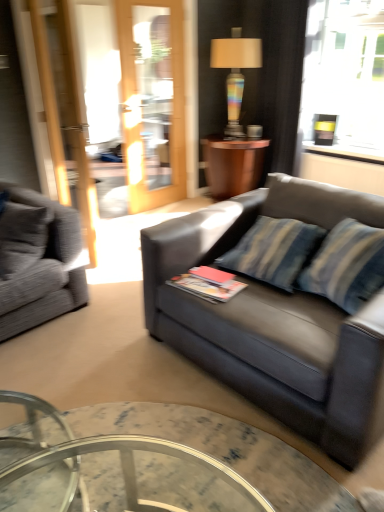
The image size is (384, 512). What do you see at coordinates (38, 261) in the screenshot?
I see `gray fabric couch at left, marked as the second studio couch in a right-to-left arrangement` at bounding box center [38, 261].

Image resolution: width=384 pixels, height=512 pixels. What do you see at coordinates (224, 450) in the screenshot?
I see `marble glass coffee table at center` at bounding box center [224, 450].

This screenshot has width=384, height=512. What do you see at coordinates (275, 320) in the screenshot? I see `slate gray leather couch at center, which is counted as the 2th studio couch, starting from the left` at bounding box center [275, 320].

Locate an element on the screen. gray fabric couch at left, the 1th studio couch viewed from the left is located at coordinates (38, 261).

Is matte paper book at center positioned with its back to slate gray leather couch at center, which is the 1th studio couch in right-to-left order?

Yes, matte paper book at center is facing away from slate gray leather couch at center, which is the 1th studio couch in right-to-left order.

Which object is closer to the camera taking this photo, matte paper book at center or slate gray leather couch at center, which is the 1th studio couch in right-to-left order?

Positioned in front is slate gray leather couch at center, which is the 1th studio couch in right-to-left order.

Who is bigger, matte paper book at center or slate gray leather couch at center, which is counted as the 2th studio couch, starting from the left?

slate gray leather couch at center, which is counted as the 2th studio couch, starting from the left.

Is matte paper book at center to the right of slate gray leather couch at center, which is the 1th studio couch in right-to-left order, from the viewer's perspective?

No, matte paper book at center is not to the right of slate gray leather couch at center, which is the 1th studio couch in right-to-left order.

From the picture: From a real-world perspective, between rainbow glass lamp at upper center and matte paper book at center, who is vertically lower?

From a 3D spatial view, matte paper book at center is below.

This screenshot has width=384, height=512. Identify the location of book below the rainbow glass lamp at upper center (from a real-world perspective). (208, 284).

Is rainbow glass lamp at upper center taller than matte paper book at center?

Correct, rainbow glass lamp at upper center is much taller as matte paper book at center.

Can you confirm if slate gray leather couch at center, which is the 1th studio couch in right-to-left order, is taller than gray fabric couch at left, marked as the second studio couch in a right-to-left arrangement?

Correct, slate gray leather couch at center, which is the 1th studio couch in right-to-left order, is much taller as gray fabric couch at left, marked as the second studio couch in a right-to-left arrangement.

Considering the relative positions of slate gray leather couch at center, which is counted as the 2th studio couch, starting from the left, and gray fabric couch at left, the 1th studio couch viewed from the left, in the image provided, is slate gray leather couch at center, which is counted as the 2th studio couch, starting from the left, in front of gray fabric couch at left, the 1th studio couch viewed from the left,?

Yes, slate gray leather couch at center, which is counted as the 2th studio couch, starting from the left, is closer to the viewer.

Looking at this image, from the image's perspective, does slate gray leather couch at center, which is counted as the 2th studio couch, starting from the left, appear higher than gray fabric couch at left, the 1th studio couch viewed from the left?

No, from the image's perspective, slate gray leather couch at center, which is counted as the 2th studio couch, starting from the left, is not over gray fabric couch at left, the 1th studio couch viewed from the left.

In terms of width, does slate gray leather couch at center, which is the 1th studio couch in right-to-left order, look wider or thinner when compared to gray fabric couch at left, the 1th studio couch viewed from the left?

Clearly, slate gray leather couch at center, which is the 1th studio couch in right-to-left order, has more width compared to gray fabric couch at left, the 1th studio couch viewed from the left.

Is wooden side table at center beside marble glass coffee table at center?

No, wooden side table at center is not touching marble glass coffee table at center.

Image resolution: width=384 pixels, height=512 pixels. Identify the location of table lying above the marble glass coffee table at center (from the image's perspective). (232, 164).

Is wooden side table at center outside of marble glass coffee table at center?

Yes, wooden side table at center is not within marble glass coffee table at center.

Between wooden side table at center and marble glass coffee table at center, which one is positioned behind?

wooden side table at center is behind.

Based on the photo, could you tell me if wooden side table at center is facing gray fabric couch at left, the 1th studio couch viewed from the left?

No.

Based on the photo, considering the relative sizes of wooden side table at center and gray fabric couch at left, the 1th studio couch viewed from the left, in the image provided, is wooden side table at center shorter than gray fabric couch at left, the 1th studio couch viewed from the left,?

In fact, wooden side table at center may be taller than gray fabric couch at left, the 1th studio couch viewed from the left.

Can you tell me how much wooden side table at center and gray fabric couch at left, marked as the second studio couch in a right-to-left arrangement, differ in facing direction?

They differ by 81.8 degrees in their facing directions.

At what (x,y) coordinates should I click in order to perform the action: click on table behind the gray fabric couch at left, the 1th studio couch viewed from the left. Please return your answer as a coordinate pair (x, y). Looking at the image, I should click on (232, 164).

From a real-world perspective, between marble glass coffee table at center and gray fabric couch at left, marked as the second studio couch in a right-to-left arrangement, who is vertically lower?

marble glass coffee table at center is physically lower.

You are a GUI agent. You are given a task and a screenshot of the screen. Output one action in this format:
    pyautogui.click(x=<x>, y=<y>)
    Task: Click on the coffee table below the gray fabric couch at left, marked as the second studio couch in a right-to-left arrangement (from the image's perspective)
    The height and width of the screenshot is (512, 384).
    Given the screenshot: What is the action you would take?
    pyautogui.click(x=224, y=450)

How many degrees apart are the facing directions of marble glass coffee table at center and gray fabric couch at left, marked as the second studio couch in a right-to-left arrangement?

173 degrees.

Are marble glass coffee table at center and gray fabric couch at left, the 1th studio couch viewed from the left, beside each other?

There is a gap between marble glass coffee table at center and gray fabric couch at left, the 1th studio couch viewed from the left.

Which is in front, point (233, 148) or point (184, 313)?

The point (184, 313) is more forward.

In the scene shown: Is wooden side table at center completely or partially outside of slate gray leather couch at center, which is the 1th studio couch in right-to-left order?

wooden side table at center lies outside slate gray leather couch at center, which is the 1th studio couch in right-to-left order,'s area.

How different are the orientations of wooden side table at center and slate gray leather couch at center, which is the 1th studio couch in right-to-left order, in degrees?

88.9 degrees.

Does wooden side table at center lie behind slate gray leather couch at center, which is the 1th studio couch in right-to-left order?

Yes, it is.

Find the location of a particular element. The height and width of the screenshot is (512, 384). studio couch on the right of the matte paper book at center is located at coordinates (275, 320).

You are a GUI agent. You are given a task and a screenshot of the screen. Output one action in this format:
    pyautogui.click(x=<x>, y=<y>)
    Task: Click on the lamp behind the matte paper book at center
    
    Given the screenshot: What is the action you would take?
    pyautogui.click(x=235, y=72)

Which object lies nearer to the anchor point wooden side table at center, marble glass coffee table at center or rainbow glass lamp at upper center?

The object closer to wooden side table at center is rainbow glass lamp at upper center.

Which object lies nearer to the anchor point matte paper book at center, wooden side table at center or marble glass coffee table at center?

Among the two, marble glass coffee table at center is located nearer to matte paper book at center.

Looking at the image, which one is located closer to wooden side table at center, matte paper book at center or marble glass coffee table at center?

matte paper book at center is closer to wooden side table at center.

Based on their spatial positions, is gray fabric couch at left, the 1th studio couch viewed from the left, or marble glass coffee table at center further from matte paper book at center?

gray fabric couch at left, the 1th studio couch viewed from the left, lies further to matte paper book at center than the other object.

Looking at the image, which one is located further to marble glass coffee table at center, rainbow glass lamp at upper center or matte paper book at center?

rainbow glass lamp at upper center is further to marble glass coffee table at center.

When comparing their distances from slate gray leather couch at center, which is counted as the 2th studio couch, starting from the left, does rainbow glass lamp at upper center or wooden side table at center seem further?

rainbow glass lamp at upper center.

Looking at the image, which one is located closer to wooden side table at center, slate gray leather couch at center, which is the 1th studio couch in right-to-left order, or marble glass coffee table at center?

Based on the image, slate gray leather couch at center, which is the 1th studio couch in right-to-left order, appears to be nearer to wooden side table at center.

Based on their spatial positions, is gray fabric couch at left, the 1th studio couch viewed from the left, or matte paper book at center further from marble glass coffee table at center?

gray fabric couch at left, the 1th studio couch viewed from the left.

Locate an element on the screen. book between marble glass coffee table at center and rainbow glass lamp at upper center in the front-back direction is located at coordinates (208, 284).

You are a GUI agent. You are given a task and a screenshot of the screen. Output one action in this format:
    pyautogui.click(x=<x>, y=<y>)
    Task: Click on the lamp between marble glass coffee table at center and wooden side table at center along the z-axis
    Image resolution: width=384 pixels, height=512 pixels.
    Given the screenshot: What is the action you would take?
    pyautogui.click(x=235, y=72)

Find the location of `studio couch between slate gray leather couch at center, which is counted as the 2th studio couch, starting from the left, and rainbow glass lamp at upper center, along the z-axis`. studio couch between slate gray leather couch at center, which is counted as the 2th studio couch, starting from the left, and rainbow glass lamp at upper center, along the z-axis is located at coordinates (38, 261).

You are a GUI agent. You are given a task and a screenshot of the screen. Output one action in this format:
    pyautogui.click(x=<x>, y=<y>)
    Task: Click on the studio couch located between matte paper book at center and wooden side table at center in the depth direction
    The image size is (384, 512).
    Given the screenshot: What is the action you would take?
    pyautogui.click(x=38, y=261)